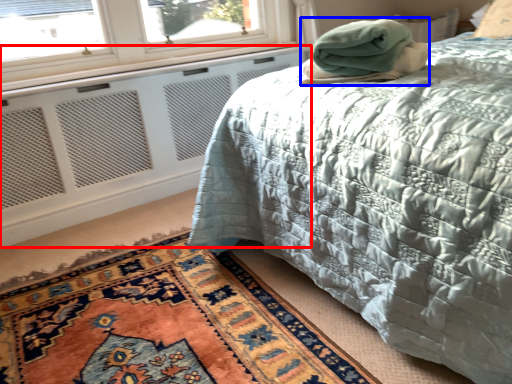
Question: Which point is closer to the camera, radiator (highlighted by a red box) or blanket (highlighted by a blue box)?

Choices:
 (A) radiator
 (B) blanket

Answer: (B)